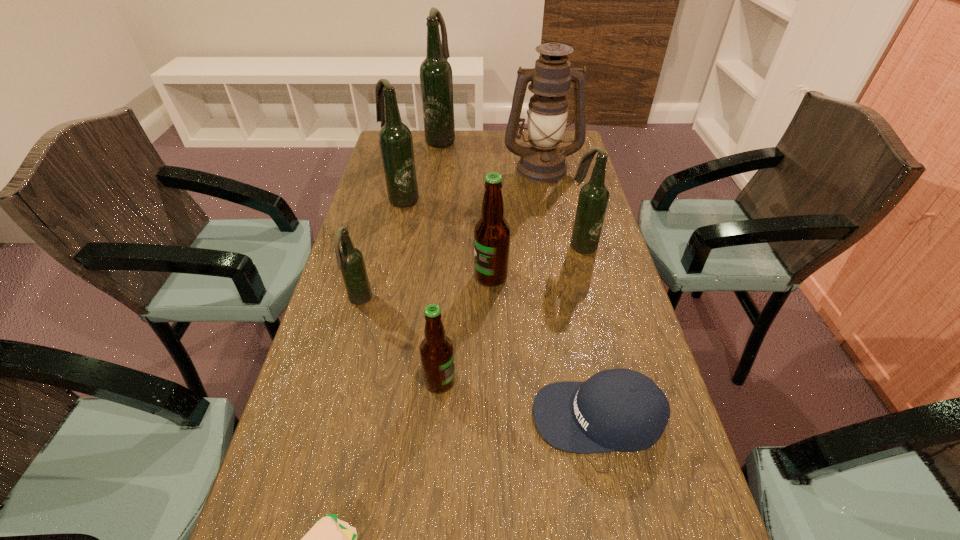
The image size is (960, 540). Find the location of `oil lamp at the right edge`. oil lamp at the right edge is located at coordinates (543, 161).

Where is `beer bottle that is at the right edge`? The height and width of the screenshot is (540, 960). beer bottle that is at the right edge is located at coordinates (593, 199).

This screenshot has height=540, width=960. Identify the location of baseball cap that is at the right edge. click(624, 410).

Where is `object that is at the far right corner`? This screenshot has height=540, width=960. object that is at the far right corner is located at coordinates (543, 161).

Locate an element on the screen. Image resolution: width=960 pixels, height=540 pixels. vacant point at the far edge is located at coordinates (484, 140).

The height and width of the screenshot is (540, 960). In order to click on free space at the left edge of the desktop in this screenshot , I will do `click(318, 448)`.

Locate an element on the screen. vacant space at the right edge of the desktop is located at coordinates (565, 176).

Where is `free spot at the far left corner of the desktop`? The width and height of the screenshot is (960, 540). free spot at the far left corner of the desktop is located at coordinates (378, 157).

Find the location of a particular element. empty space between the bigger brown beer bottle and the rightmost dark beer bottle is located at coordinates (536, 261).

This screenshot has width=960, height=540. I want to click on unoccupied position between the blue baseball cap and the eighth nearest object, so click(x=570, y=292).